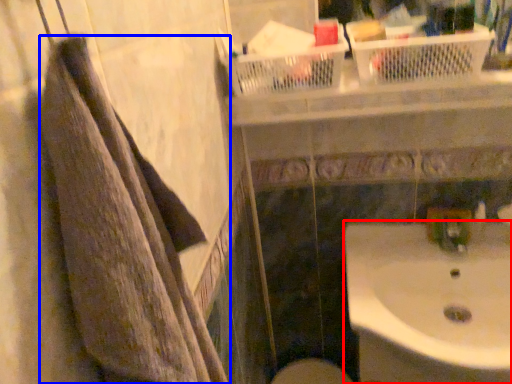
Question: Which object is further to the camera taking this photo, sink (highlighted by a red box) or towel (highlighted by a blue box)?

Choices:
 (A) sink
 (B) towel

Answer: (A)